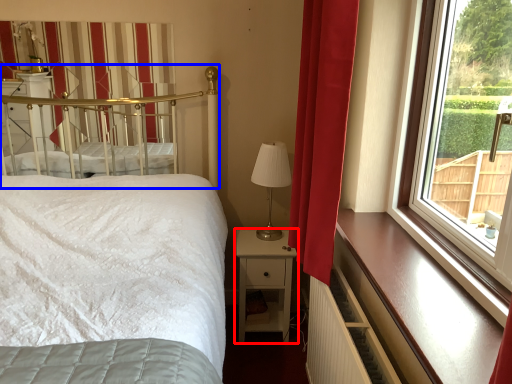
Question: Which object appears farthest to the camera in this image, nightstand (highlighted by a red box) or canopy bed (highlighted by a blue box)?

Choices:
 (A) nightstand
 (B) canopy bed

Answer: (A)